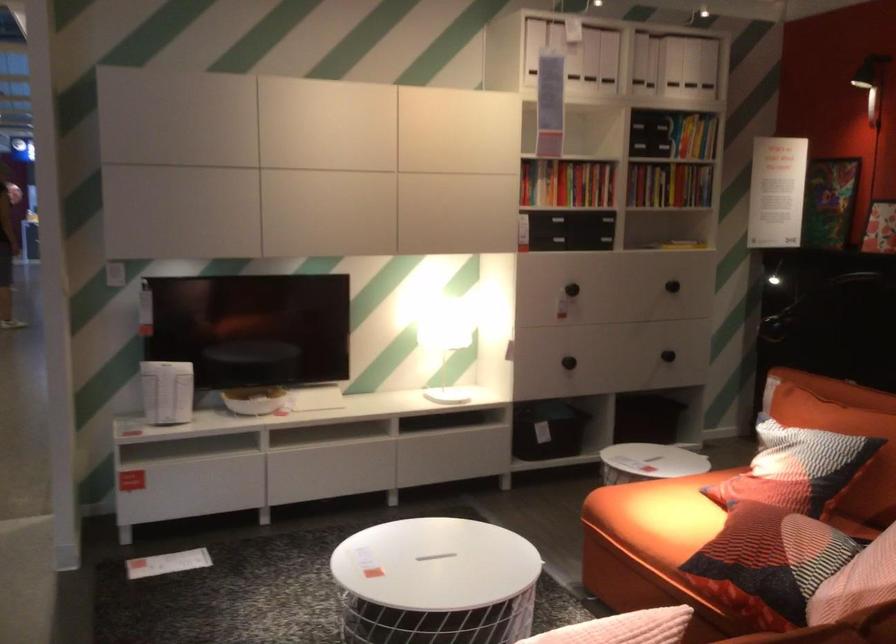
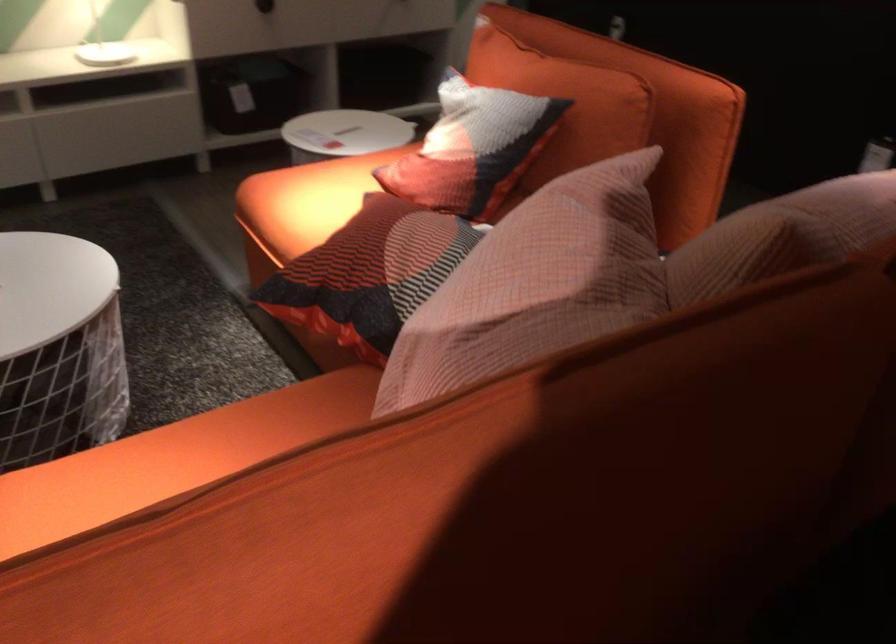
The point at [755,562] is marked in the first image. Where is the corresponding point in the second image?

(369, 274)